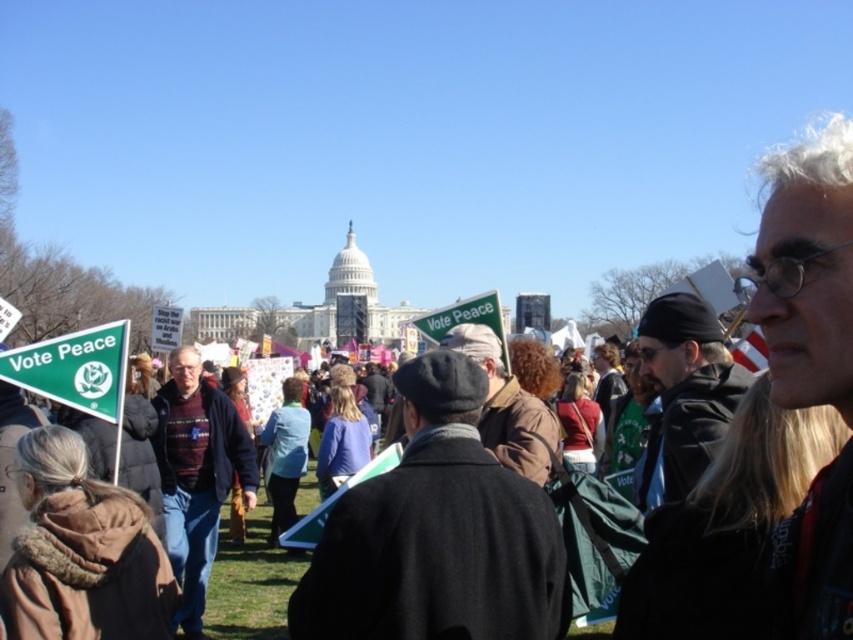
Question: In this image, where is white hair at center located relative to brown leather jacket at center?

Choices:
 (A) above
 (B) below

Answer: (A)

Question: Which of these objects is positioned farthest from the white hair at center?

Choices:
 (A) dark gray wool coat at center
 (B) brown leather jacket at center
 (C) dark brown leather jacket at center
 (D) striped sweater at center

Answer: (D)

Question: Which point appears farthest from the camera in this image?

Choices:
 (A) (491, 358)
 (B) (463, 518)

Answer: (A)

Question: Which point is closer to the camera?

Choices:
 (A) (195, 412)
 (B) (666, 460)
 (C) (763, 316)

Answer: (C)

Question: Does dark gray wool coat at center have a greater width compared to dark brown leather jacket at center?

Choices:
 (A) yes
 (B) no

Answer: (A)

Question: Considering the relative positions of dark brown leather jacket at center and brown leather jacket at center in the image provided, where is dark brown leather jacket at center located with respect to brown leather jacket at center?

Choices:
 (A) above
 (B) below

Answer: (A)